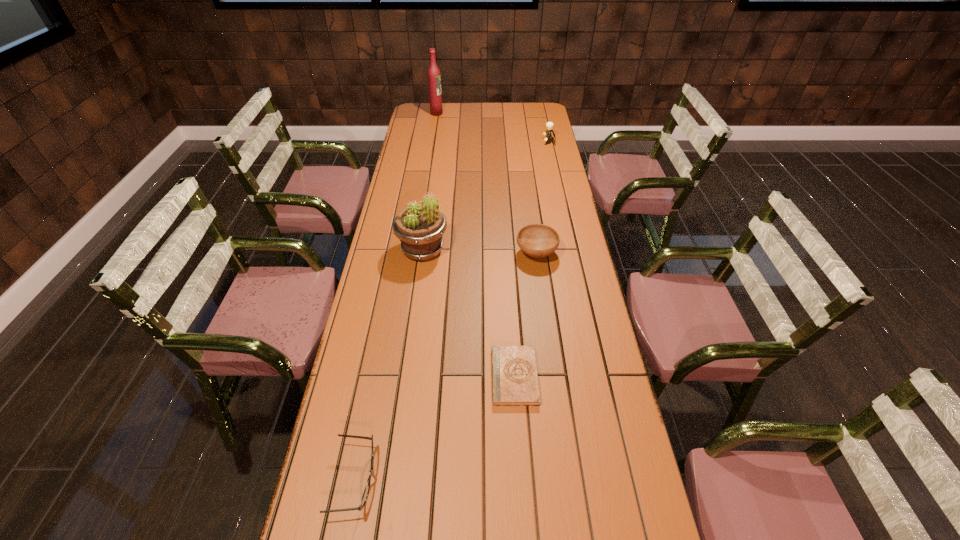
What are the coordinates of `vacant space in between the second tallest object and the fifth farthest object` in the screenshot? It's located at (468, 313).

This screenshot has height=540, width=960. In order to click on unoccupied position between the second farthest object and the fourth tallest object in this screenshot , I will do `click(542, 198)`.

At what (x,y) coordinates should I click in order to perform the action: click on free space between the tallest object and the third tallest object. Please return your answer as a coordinate pair (x, y). Looking at the image, I should click on (492, 127).

This screenshot has height=540, width=960. Find the location of `unoccupied area between the flowerpot and the bowl`. unoccupied area between the flowerpot and the bowl is located at coordinates (480, 252).

Identify the location of vacant area that lies between the farthest object and the fourth tallest object. This screenshot has height=540, width=960. (487, 184).

The width and height of the screenshot is (960, 540). Identify the location of empty space that is in between the spectacles and the liquor. (396, 296).

Find the location of `free space between the fifth shortest object and the diary`. free space between the fifth shortest object and the diary is located at coordinates (468, 313).

The image size is (960, 540). What are the coordinates of `vacant area between the farthest object and the second nearest object` in the screenshot? It's located at (475, 245).

This screenshot has height=540, width=960. Identify the location of vacant area that lies between the second shortest object and the tallest object. (396, 296).

Identify the location of free space between the flowerpot and the shortest object. The height and width of the screenshot is (540, 960). (468, 313).